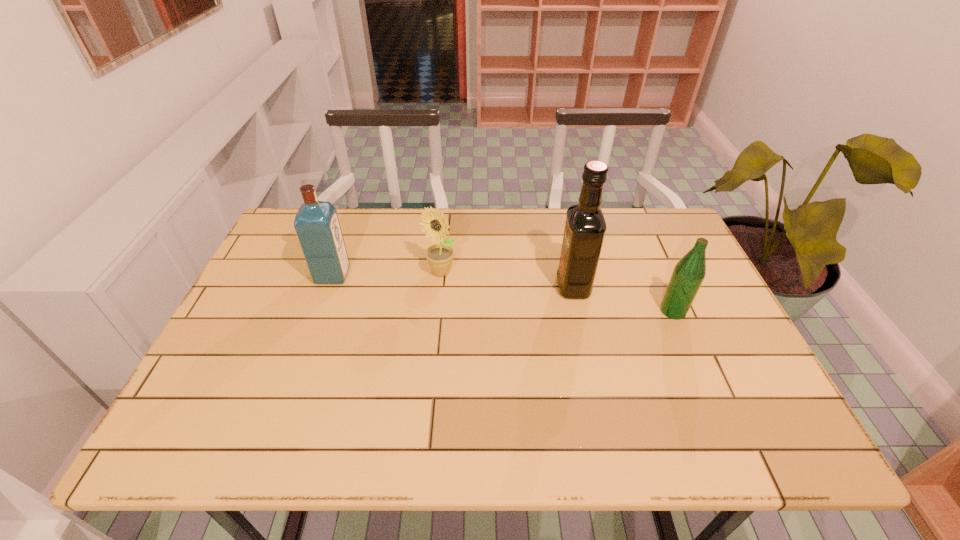
Image resolution: width=960 pixels, height=540 pixels. Find the location of `object that stands as the second closest to the rightmost object`. object that stands as the second closest to the rightmost object is located at coordinates (440, 256).

Identify the location of free space in the image that satisfies the following two spatial constraints: 1. on the front-facing side of the right liquor; 2. on the right side of the rightmost object. (579, 311).

Find the location of `vacant region that satisfies the following two spatial constraints: 1. on the face of the bottle; 2. on the right side of the third object from right to left`. vacant region that satisfies the following two spatial constraints: 1. on the face of the bottle; 2. on the right side of the third object from right to left is located at coordinates (437, 311).

This screenshot has width=960, height=540. Find the location of `free space in the image that satisfies the following two spatial constraints: 1. on the face of the second object from left to right; 2. on the flat label side of the leftmost object`. free space in the image that satisfies the following two spatial constraints: 1. on the face of the second object from left to right; 2. on the flat label side of the leftmost object is located at coordinates (441, 275).

This screenshot has width=960, height=540. Identify the location of free space that satisfies the following two spatial constraints: 1. on the flat label side of the shorter liquor; 2. on the left side of the bottle. (320, 311).

Where is `free location that satisfies the following two spatial constraints: 1. on the back side of the rightmost object; 2. on the front-facing side of the third object from left to right`? The width and height of the screenshot is (960, 540). free location that satisfies the following two spatial constraints: 1. on the back side of the rightmost object; 2. on the front-facing side of the third object from left to right is located at coordinates (662, 286).

Find the location of `free location that satisfies the following two spatial constraints: 1. on the face of the sunflower; 2. on the left side of the bottle`. free location that satisfies the following two spatial constraints: 1. on the face of the sunflower; 2. on the left side of the bottle is located at coordinates (437, 311).

Image resolution: width=960 pixels, height=540 pixels. Find the location of `vacant space that satisfies the following two spatial constraints: 1. on the face of the third object from right to left; 2. on the flat label side of the shorter liquor`. vacant space that satisfies the following two spatial constraints: 1. on the face of the third object from right to left; 2. on the flat label side of the shorter liquor is located at coordinates 441,275.

At what (x,y) coordinates should I click in order to perform the action: click on vacant position in the image that satisfies the following two spatial constraints: 1. on the face of the sunflower; 2. on the left side of the rightmost object. Please return your answer as a coordinate pair (x, y). Looking at the image, I should click on (437, 311).

You are a GUI agent. You are given a task and a screenshot of the screen. Output one action in this format:
    pyautogui.click(x=<x>, y=<y>)
    Task: Click on the blank space that satisfies the following two spatial constraints: 1. on the flat label side of the bottle; 2. on the right side of the third shortest object
    
    Given the screenshot: What is the action you would take?
    pyautogui.click(x=320, y=311)